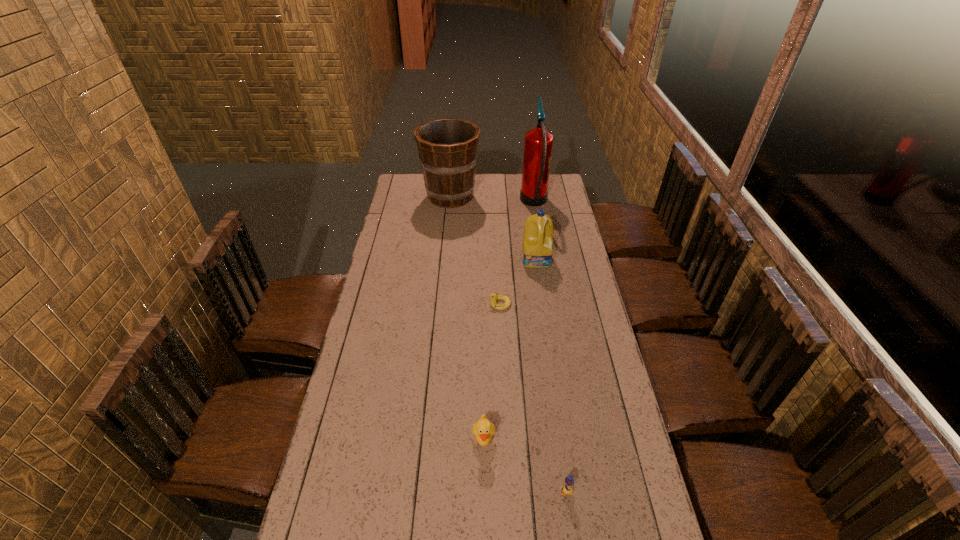
Locate an element on the screen. This screenshot has height=540, width=960. fire extinguisher is located at coordinates (538, 143).

Identify the location of bucket. (447, 147).

Where is `detergent`? detergent is located at coordinates (537, 248).

Where is `the third farthest object`? the third farthest object is located at coordinates (537, 248).

Identify the location of the second nearest duckling. The width and height of the screenshot is (960, 540). point(483,430).

At what (x,y) coordinates should I click in order to perform the action: click on the tallest duckling. Please return your answer as a coordinate pair (x, y). Looking at the image, I should click on (483, 430).

Image resolution: width=960 pixels, height=540 pixels. Find the location of `the nearest object`. the nearest object is located at coordinates (x=567, y=489).

Identify the location of the fifth tallest object. (567, 489).

Find the location of a particular element. Image resolution: width=960 pixels, height=540 pixels. the shortest object is located at coordinates (494, 297).

You are a GUI agent. You are given a task and a screenshot of the screen. Output one action in this format:
    pyautogui.click(x=<x>, y=<y>)
    Task: Click on the farthest duckling
    The image size is (960, 540).
    Given the screenshot: What is the action you would take?
    pyautogui.click(x=494, y=297)